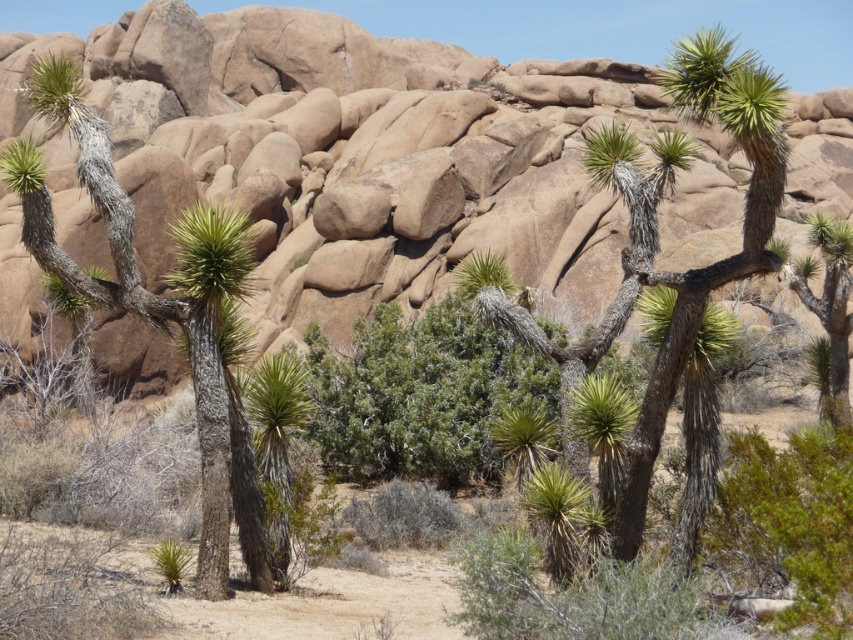
Between gray bark tree at center and green spiky plant at center, which one appears on the right side from the viewer's perspective?

Positioned to the right is green spiky plant at center.

Can you confirm if gray bark tree at center is smaller than green spiky plant at center?

Correct, gray bark tree at center occupies less space than green spiky plant at center.

The width and height of the screenshot is (853, 640). Describe the element at coordinates (160, 308) in the screenshot. I see `gray bark tree at center` at that location.

The height and width of the screenshot is (640, 853). Identify the location of gray bark tree at center. (160, 308).